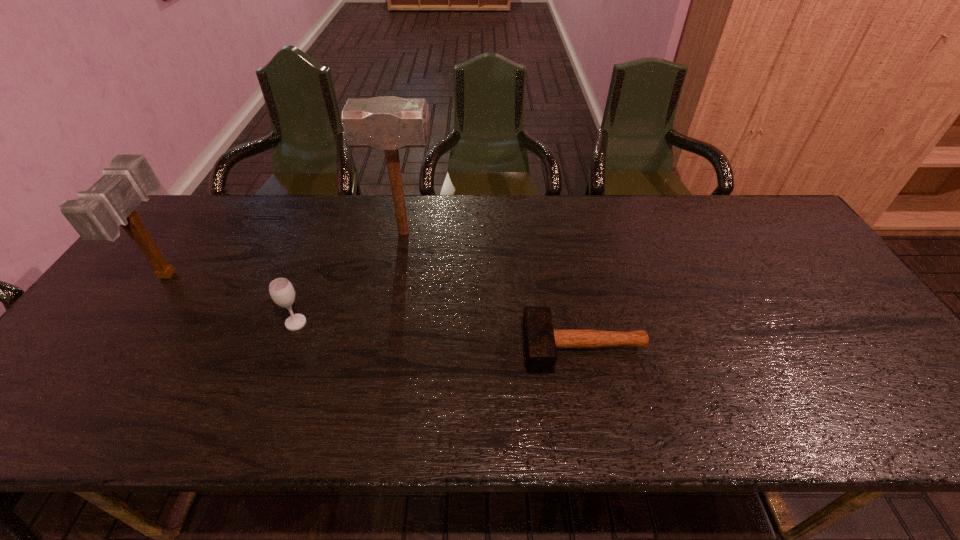
You are a GUI agent. You are given a task and a screenshot of the screen. Output one action in this format:
    pyautogui.click(x=<x>, y=<y>)
    Task: Click on the object that is the second closest to the rightmost object
    The width and height of the screenshot is (960, 540).
    Given the screenshot: What is the action you would take?
    tap(281, 290)

Select which object appears as the closest to the shortest object. Please provide its 2D coordinates. Your answer should be formatted as a tuple, i.e. [(x, y)], where the tuple contains the x and y coordinates of a point satisfying the conditions above.

[(385, 123)]

Point out which mallet is positioned as the nearest to the second object from right to left. Please provide its 2D coordinates. Your answer should be formatted as a tuple, i.e. [(x, y)], where the tuple contains the x and y coordinates of a point satisfying the conditions above.

[(541, 341)]

Locate which mallet ranks in proximity to the rightmost mallet. Please provide its 2D coordinates. Your answer should be formatted as a tuple, i.e. [(x, y)], where the tuple contains the x and y coordinates of a point satisfying the conditions above.

[(385, 123)]

Where is `vacant space that satisfies the following two spatial constraints: 1. on the striking face of the tallest mallet; 2. on the front side of the third tallest object`? The height and width of the screenshot is (540, 960). vacant space that satisfies the following two spatial constraints: 1. on the striking face of the tallest mallet; 2. on the front side of the third tallest object is located at coordinates [x=387, y=323].